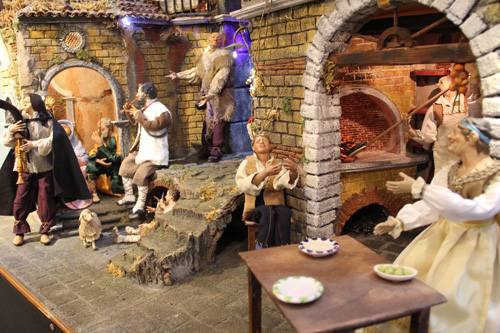
Find the location of a particular element. The width and height of the screenshot is (500, 333). stairs is located at coordinates (131, 267), (135, 253), (159, 247), (187, 226), (188, 203), (196, 182), (109, 226), (110, 218), (108, 203).